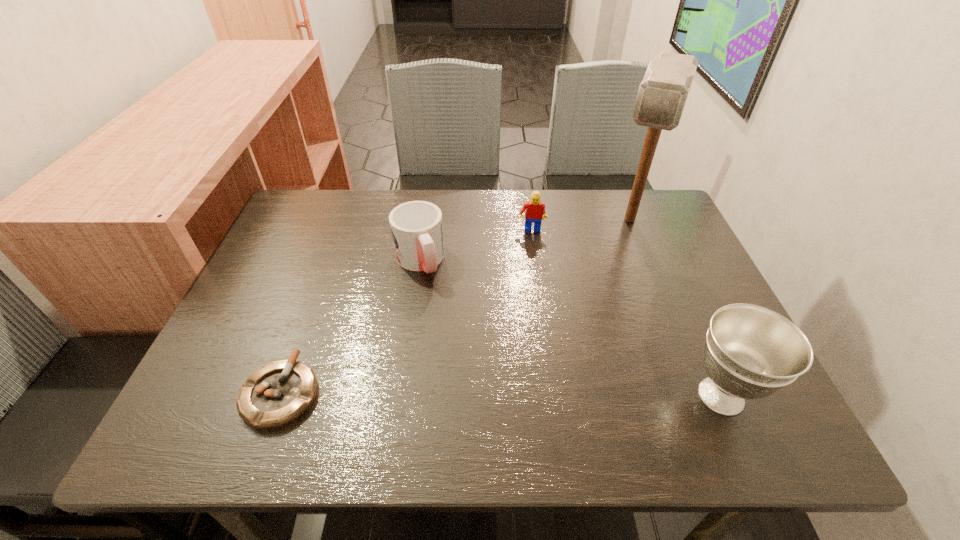
You are a GUI agent. You are given a task and a screenshot of the screen. Output one action in this format:
    pyautogui.click(x=<x>, y=<y>)
    Task: Click on the free spot located on the front-facing side of the Lego
    The height and width of the screenshot is (540, 960).
    Given the screenshot: What is the action you would take?
    pos(529,259)

You are a GUI agent. You are given a task and a screenshot of the screen. Output one action in this format:
    pyautogui.click(x=<x>, y=<y>)
    Task: Click on the vacant position located 0.080m on the side of the second object from left to right with the handle
    
    Given the screenshot: What is the action you would take?
    pyautogui.click(x=436, y=306)

I want to click on free spot located on the side of the second object from left to right with the handle, so click(x=445, y=327).

Identify the location of free space located on the side of the second object from left to right with the handle. This screenshot has width=960, height=540. (463, 366).

This screenshot has width=960, height=540. In order to click on vacant space located 0.380m above the head of the tallest object in this screenshot , I will do `click(588, 345)`.

At what (x,y) coordinates should I click in order to perform the action: click on blank space located above the head of the tallest object. Please return your answer as a coordinate pair (x, y). Looking at the image, I should click on (613, 275).

Locate an element on the screen. Image resolution: width=960 pixels, height=540 pixels. free region located above the head of the tallest object is located at coordinates (592, 335).

In order to click on Lego that is at the far edge in this screenshot , I will do `click(535, 210)`.

This screenshot has width=960, height=540. What are the coordinates of `mug present at the far edge` in the screenshot? It's located at (417, 229).

Find the location of `mallet that is at the far edge`. mallet that is at the far edge is located at coordinates (662, 94).